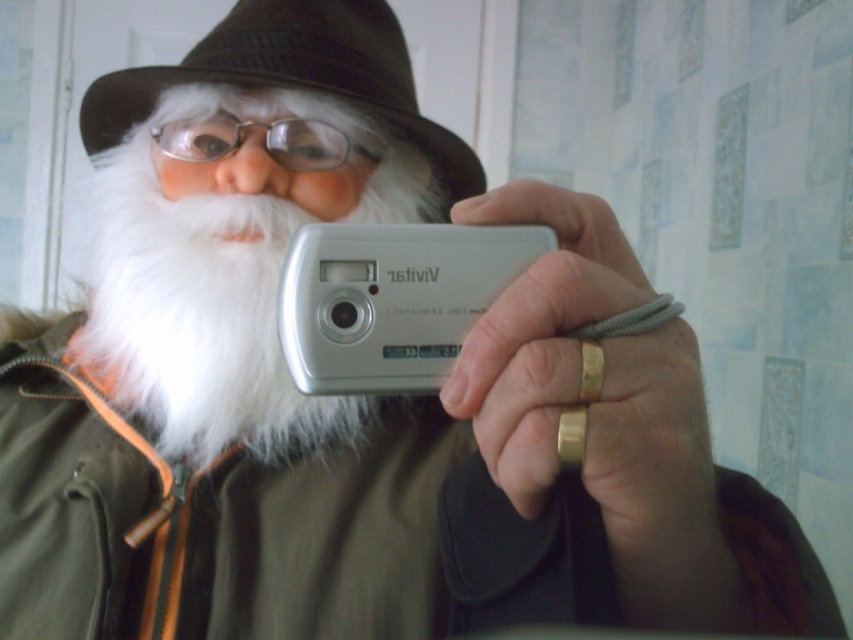
Locate an element on the screen. white fluffy beard at center is located at coordinates (225, 276).

Between white fluffy beard at center and black felt hat at upper center, which one is positioned lower?

white fluffy beard at center is lower down.

Is point (136, 406) farther from viewer compared to point (369, 81)?

No, it is not.

At what (x,y) coordinates should I click in order to perform the action: click on white fluffy beard at center. Please return your answer as a coordinate pair (x, y). Looking at the image, I should click on (225, 276).

Is silver metallic digital camera at center taller than clear plastic glasses at center?

Indeed, silver metallic digital camera at center has a greater height compared to clear plastic glasses at center.

Who is taller, silver metallic digital camera at center or clear plastic glasses at center?

silver metallic digital camera at center is taller.

Where is `silver metallic digital camera at center`? The height and width of the screenshot is (640, 853). silver metallic digital camera at center is located at coordinates (392, 300).

The width and height of the screenshot is (853, 640). Find the location of `silver metallic digital camera at center`. silver metallic digital camera at center is located at coordinates (392, 300).

Who is taller, black felt hat at upper center or clear plastic glasses at center?

black felt hat at upper center is taller.

Can you confirm if black felt hat at upper center is wider than clear plastic glasses at center?

Yes, black felt hat at upper center is wider than clear plastic glasses at center.

Between point (189, 54) and point (311, 140), which one is positioned in front?

Point (311, 140) is in front.

The height and width of the screenshot is (640, 853). Find the location of `black felt hat at upper center`. black felt hat at upper center is located at coordinates (293, 74).